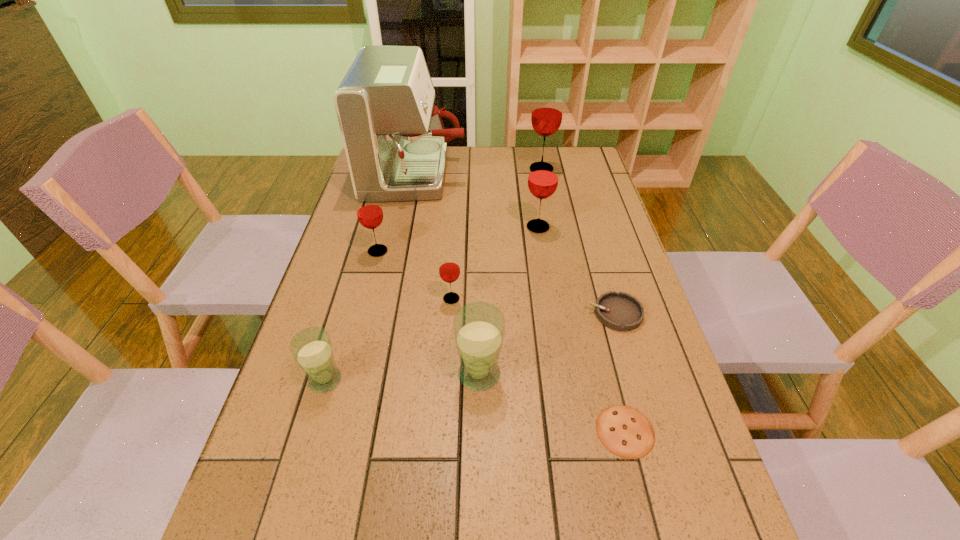
The height and width of the screenshot is (540, 960). Find the location of `free space between the left blue glass and the eighth shortest object`. free space between the left blue glass and the eighth shortest object is located at coordinates (433, 274).

The image size is (960, 540). I want to click on vacant area that lies between the right blue glass and the cookie, so click(x=552, y=402).

Locate an element on the screen. The height and width of the screenshot is (540, 960). vacant region between the gray ashtray and the second nearest red glass is located at coordinates (496, 282).

Choose which object is the nearest neighbor to the fourth farthest object. Please provide its 2D coordinates. Your answer should be formatted as a tuple, i.e. [(x, y)], where the tuple contains the x and y coordinates of a point satisfying the conditions above.

[(395, 142)]

Select which object appears as the fourth closest to the coffee maker. Please provide its 2D coordinates. Your answer should be formatted as a tuple, i.e. [(x, y)], where the tuple contains the x and y coordinates of a point satisfying the conditions above.

[(449, 269)]

The height and width of the screenshot is (540, 960). Identify the location of glass identified as the closest to the coffee maker. (369, 211).

Identify which glass is the third closest to the second red glass from left to right. Please provide its 2D coordinates. Your answer should be formatted as a tuple, i.e. [(x, y)], where the tuple contains the x and y coordinates of a point satisfying the conditions above.

[(312, 349)]

You are a GUI agent. You are given a task and a screenshot of the screen. Output one action in this format:
    pyautogui.click(x=<x>, y=<y>)
    Task: Click on the red glass that is the third closest to the second red glass from left to right
    This screenshot has height=540, width=960.
    Given the screenshot: What is the action you would take?
    pyautogui.click(x=547, y=112)

Identify which red glass is the third nearest to the left blue glass. Please provide its 2D coordinates. Your answer should be formatted as a tuple, i.e. [(x, y)], where the tuple contains the x and y coordinates of a point satisfying the conditions above.

[(543, 177)]

You are a GUI agent. You are given a task and a screenshot of the screen. Output one action in this format:
    pyautogui.click(x=<x>, y=<y>)
    Task: Click on the blank space that satisfies the following two spatial constraints: 1. on the front side of the third red glass from right to left; 2. on the left side of the eighth tallest object
    
    Given the screenshot: What is the action you would take?
    pyautogui.click(x=450, y=313)